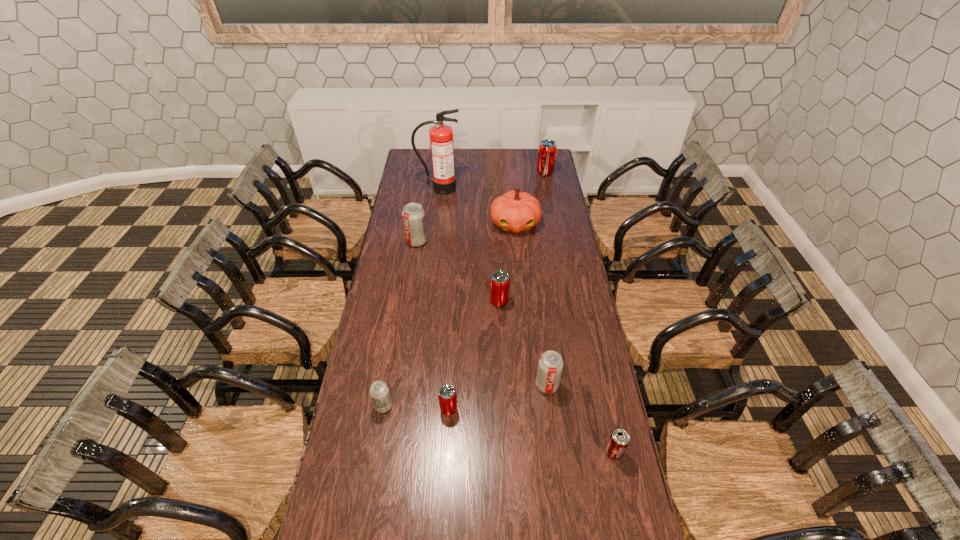
Locate an element on the screen. Image resolution: width=960 pixels, height=540 pixels. red fire extinguisher is located at coordinates (441, 136).

Locate an element on the screen. The width and height of the screenshot is (960, 540). the tallest object is located at coordinates (441, 136).

The width and height of the screenshot is (960, 540). Find the location of `pumpkin`. pumpkin is located at coordinates (515, 211).

Where is `the farthest object`? The height and width of the screenshot is (540, 960). the farthest object is located at coordinates (547, 149).

Find the location of a particular element. The image size is (960, 540). the farthest red soda can is located at coordinates (547, 149).

Image resolution: width=960 pixels, height=540 pixels. I want to click on the second farthest soda can, so click(413, 215).

Identify the location of the biggest gray soda can. (413, 215).

At what (x,y) coordinates should I click in order to perform the action: click on the fourth farthest soda can. Please return your answer as a coordinate pair (x, y). Looking at the image, I should click on (550, 365).

This screenshot has height=540, width=960. Identify the location of the second nearest gray soda can. (550, 365).

Identify the location of the third soda can from right to left. (499, 282).